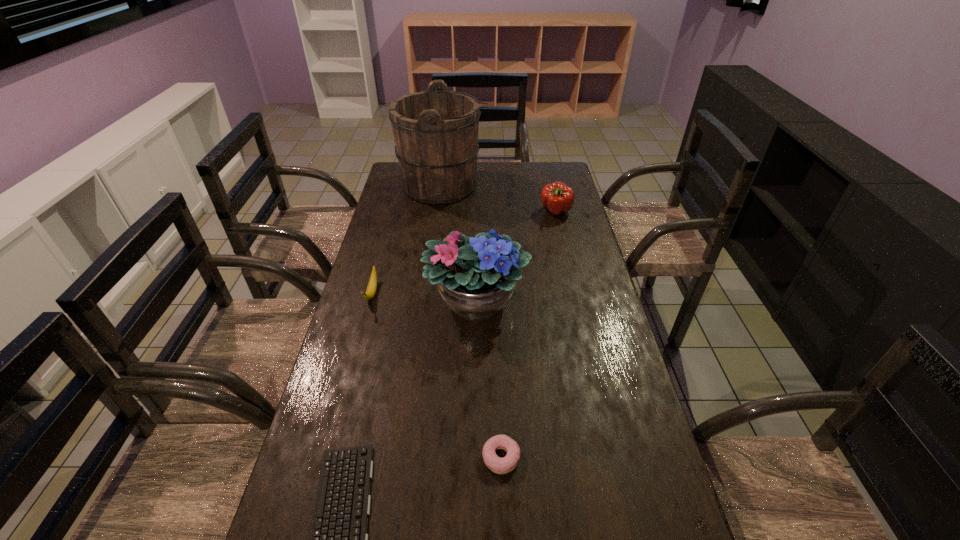
In order to click on bucket in this screenshot , I will do `click(436, 132)`.

Locate an element on the screen. bouquet is located at coordinates (475, 277).

Locate an element on the screen. The width and height of the screenshot is (960, 540). pepper is located at coordinates (558, 198).

The height and width of the screenshot is (540, 960). In order to click on the third tallest object in this screenshot , I will do coord(558,198).

I want to click on the fourth tallest object, so click(372, 285).

This screenshot has width=960, height=540. I want to click on the fifth tallest object, so click(x=498, y=465).

The image size is (960, 540). What are the coordinates of `vacant region located on the right of the tallest object` in the screenshot? It's located at (555, 186).

At what (x,y) coordinates should I click in order to perform the action: click on free location located 0.120m on the back of the bouquet. Please return your answer as a coordinate pair (x, y). The height and width of the screenshot is (540, 960). Looking at the image, I should click on click(x=477, y=250).

Find the location of a particular element. This screenshot has width=960, height=540. vacant space located 0.250m on the left of the pepper is located at coordinates (477, 212).

At what (x,y) coordinates should I click in order to perform the action: click on free location located 0.340m at the stem of the banana. Please return your answer as a coordinate pair (x, y). The image size is (960, 540). Looking at the image, I should click on (341, 410).